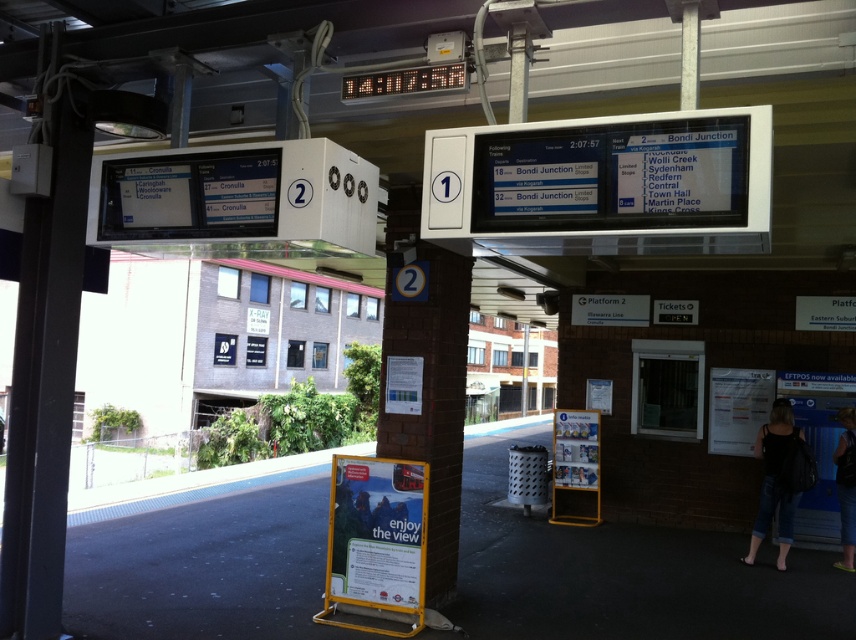
Question: Can you confirm if denim jeans at lower right is positioned to the left of dark blue denim jeans at lower right?

Choices:
 (A) no
 (B) yes

Answer: (B)

Question: Does denim jeans at lower right have a greater width compared to dark blue denim jeans at lower right?

Choices:
 (A) no
 (B) yes

Answer: (B)

Question: Which object appears farthest from the camera in this image?

Choices:
 (A) denim jeans at lower right
 (B) dark blue denim jeans at lower right

Answer: (B)

Question: Among these objects, which one is nearest to the camera?

Choices:
 (A) denim jeans at lower right
 (B) dark blue denim jeans at lower right

Answer: (A)

Question: Can you confirm if denim jeans at lower right is bigger than dark blue denim jeans at lower right?

Choices:
 (A) yes
 (B) no

Answer: (A)